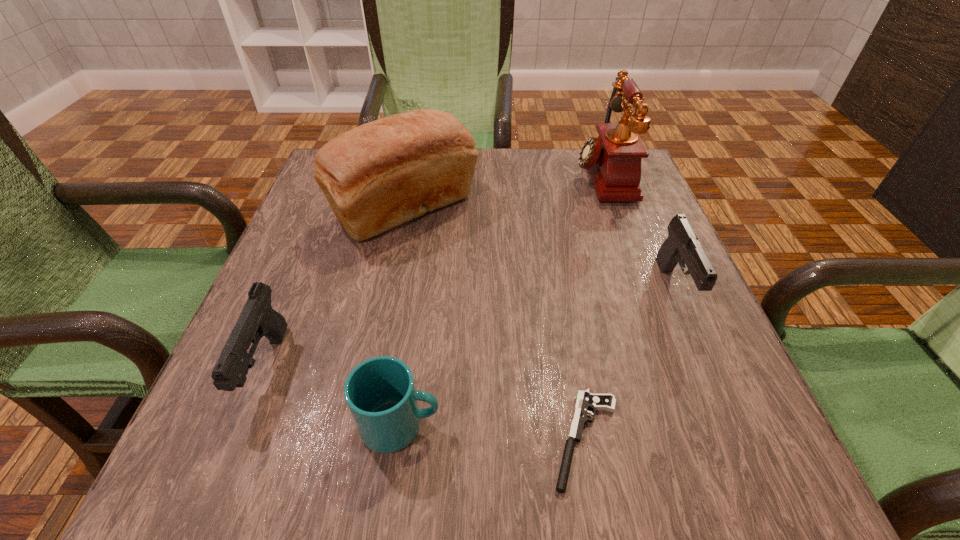
Locate an element on the screen. cup that is positioned at the near edge is located at coordinates pos(380,392).

Where is `pistol that is at the near edge`? pistol that is at the near edge is located at coordinates (585, 400).

Locate an element on the screen. This screenshot has height=540, width=960. bread at the left edge is located at coordinates (379, 175).

At what (x,y) coordinates should I click in order to perform the action: click on pistol located in the left edge section of the desktop. Please return your answer as a coordinate pair (x, y). The height and width of the screenshot is (540, 960). Looking at the image, I should click on (257, 319).

This screenshot has height=540, width=960. I want to click on telephone located in the right edge section of the desktop, so click(613, 159).

Identify the location of pistol positioned at the right edge. (682, 246).

This screenshot has width=960, height=540. What are the coordinates of `object that is at the far left corner` in the screenshot? It's located at (379, 175).

Identify the location of object that is at the far right corner. This screenshot has height=540, width=960. pyautogui.click(x=613, y=159).

Find the location of a particular element. The image size is (960, 540). vacant space at the far edge is located at coordinates (521, 192).

Identify the location of free space at the near edge of the desktop. (369, 476).